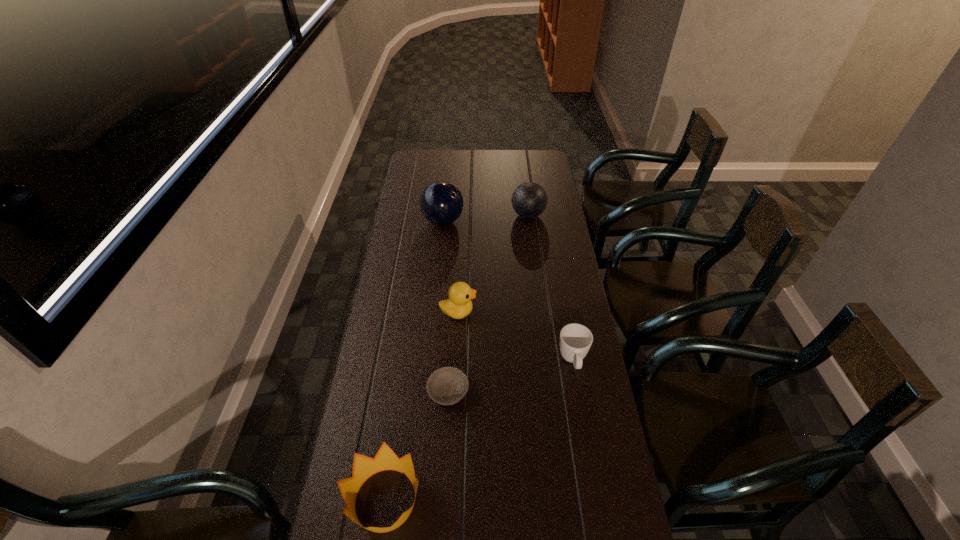
In order to click on vacant space that's between the shorter bowling ball and the cup in this screenshot , I will do `click(550, 288)`.

Find the location of `empty location between the shorter bowling ball and the shortest object`. empty location between the shorter bowling ball and the shortest object is located at coordinates (489, 303).

I want to click on free area in between the cup and the shortest object, so click(x=511, y=376).

In order to click on unoccupied position between the duck and the fifth tallest object in this screenshot , I will do `click(516, 336)`.

I want to click on free space between the second shortest object and the duck, so click(x=516, y=336).

Locate an element on the screen. This screenshot has width=960, height=540. object that stands as the second closest to the cup is located at coordinates (448, 385).

Select which object appears as the fourth closest to the bowl. Please provide its 2D coordinates. Your answer should be formatted as a tuple, i.e. [(x, y)], where the tuple contains the x and y coordinates of a point satisfying the conditions above.

[(441, 203)]

Image resolution: width=960 pixels, height=540 pixels. Identify the location of vacant space that satisfies the following two spatial constraints: 1. on the face of the fourth nearest object; 2. on the front side of the bowl. (454, 392).